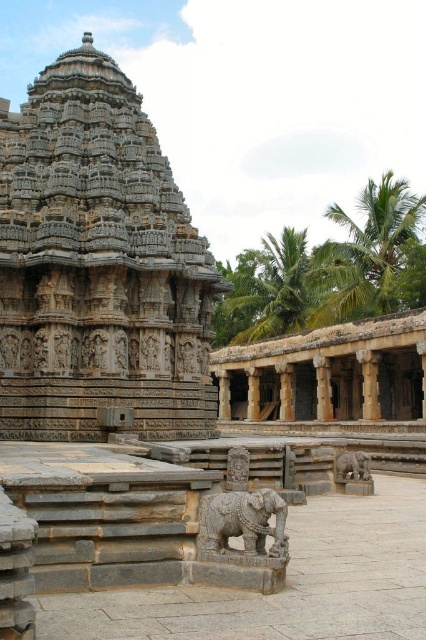
Question: Estimate the real-world distances between objects in this image. Which object is closer to the gray stone hindu temple at center?

Choices:
 (A) carved stone elephant at center
 (B) brown stone pillar at center

Answer: (A)

Question: Which object is positioned farthest from the brown stone pillar at center?

Choices:
 (A) gray stone elephant at lower center
 (B) carved stone elephant at center
 (C) gray stone hindu temple at center

Answer: (B)

Question: Which point is farther from the camera taking this photo?

Choices:
 (A) (253, 512)
 (B) (155, 138)
 (C) (362, 467)

Answer: (B)

Question: Does gray stone hindu temple at center have a smaller size compared to carved stone elephant at center?

Choices:
 (A) no
 (B) yes

Answer: (A)

Question: Does gray stone hindu temple at center have a larger size compared to gray stone elephant at lower center?

Choices:
 (A) no
 (B) yes

Answer: (B)

Question: Is gray stone hindu temple at center wider than brown stone pillar at center?

Choices:
 (A) yes
 (B) no

Answer: (A)